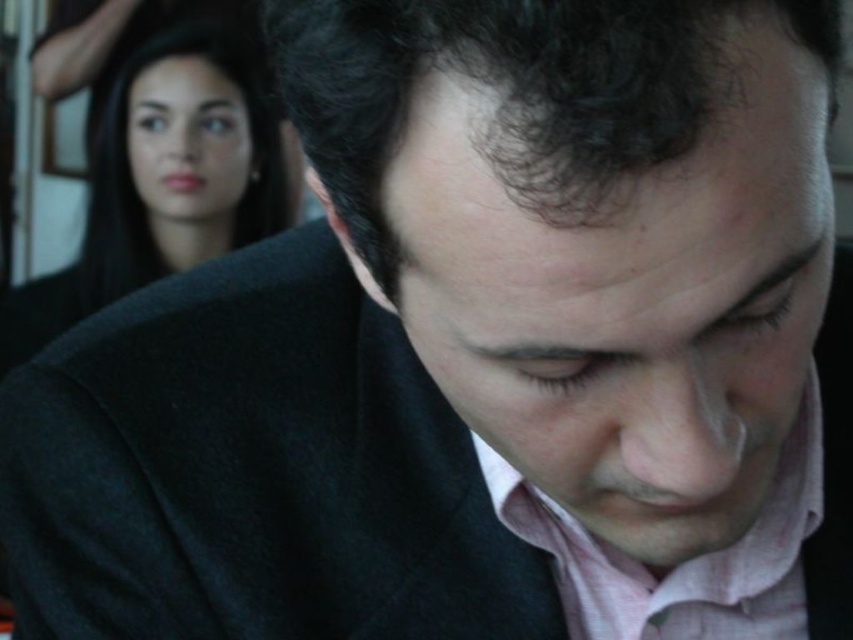
I want to click on smooth black hair at upper left, so click(163, 182).

Is smooth black hair at upper left wider than pink textured dress shirt at center?

Correct, the width of smooth black hair at upper left exceeds that of pink textured dress shirt at center.

You are a GUI agent. You are given a task and a screenshot of the screen. Output one action in this format:
    pyautogui.click(x=<x>, y=<y>)
    Task: Click on the smooth black hair at upper left
    The height and width of the screenshot is (640, 853).
    Given the screenshot: What is the action you would take?
    (x=163, y=182)